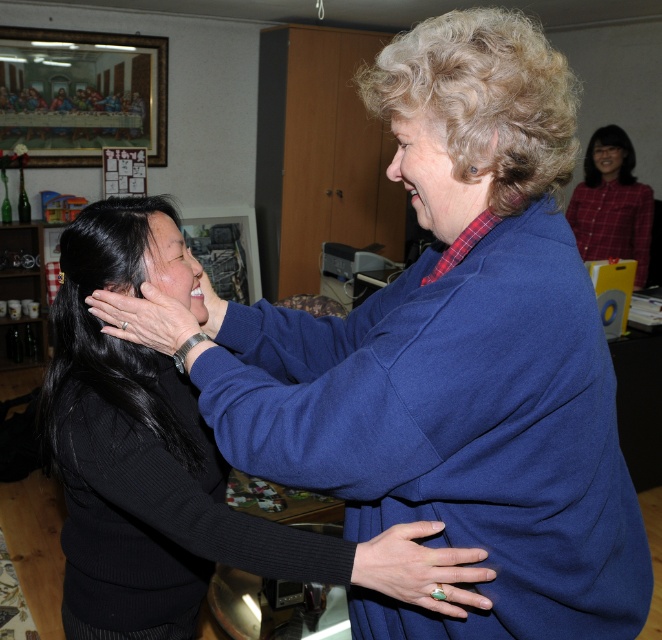
Question: Based on their relative distances, which object is nearer to the matte skin hand at center?

Choices:
 (A) green gemstone ring at center
 (B) black sweater at center
 (C) plaid fabric shirt at upper right
 (D) matte black hand at upper left

Answer: (D)

Question: Is green gemstone ring at center wider than matte black hand at upper left?

Choices:
 (A) yes
 (B) no

Answer: (B)

Question: Which point is closer to the camera taking this photo?

Choices:
 (A) (154, 221)
 (B) (203, 288)

Answer: (A)

Question: Which point appears closest to the camera in this image?

Choices:
 (A) (430, 582)
 (B) (598, 182)
 (C) (459, 561)
 (D) (201, 330)

Answer: (C)

Question: Can you confirm if black sweater at center is bigger than plaid fabric shirt at upper right?

Choices:
 (A) yes
 (B) no

Answer: (A)

Question: Is green gemstone ring at center smaller than matte black hand at upper left?

Choices:
 (A) no
 (B) yes

Answer: (B)